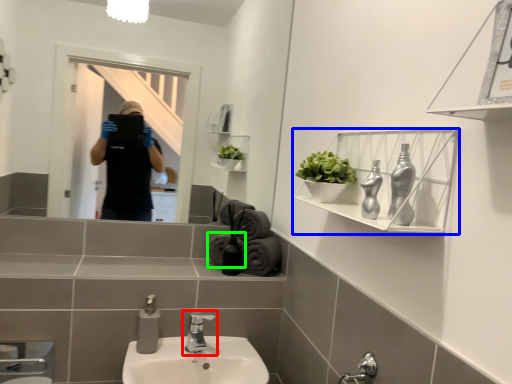
Question: Based on their relative distances, which object is farther from tap (highlighted by a red box)? Choose from shelf (highlighted by a blue box) and bath towel (highlighted by a green box).

Choices:
 (A) shelf
 (B) bath towel

Answer: (A)